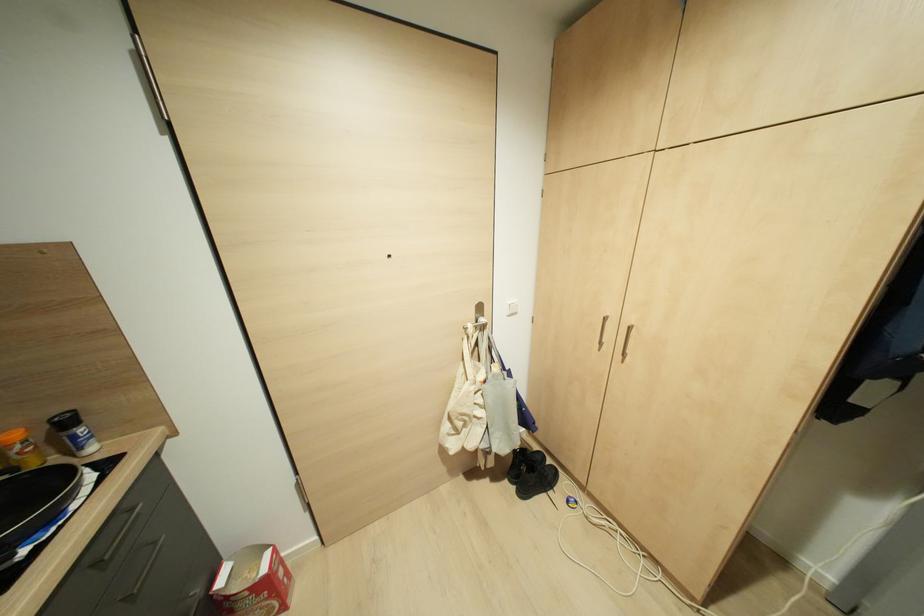
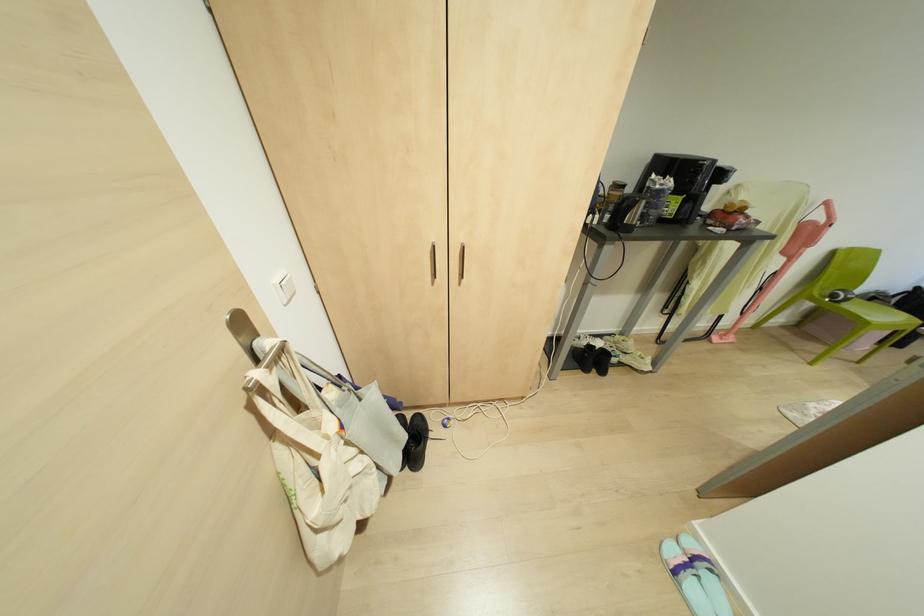
The point at [483,381] is marked in the first image. Where is the corresponding point in the second image?

(342, 426)